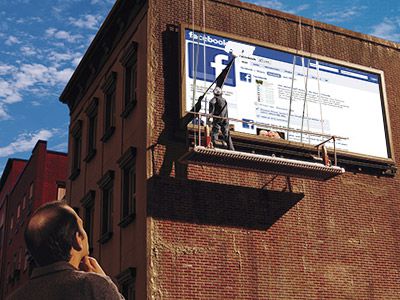
Locate an element on the screen. The width and height of the screenshot is (400, 300). brick wall is located at coordinates (263, 260).